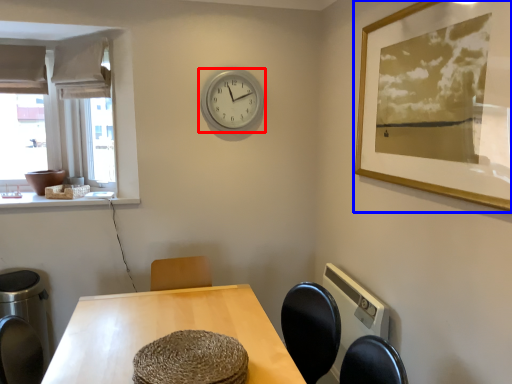
Question: Which object appears farthest to the camera in this image, wall clock (highlighted by a red box) or picture frame (highlighted by a blue box)?

Choices:
 (A) wall clock
 (B) picture frame

Answer: (A)